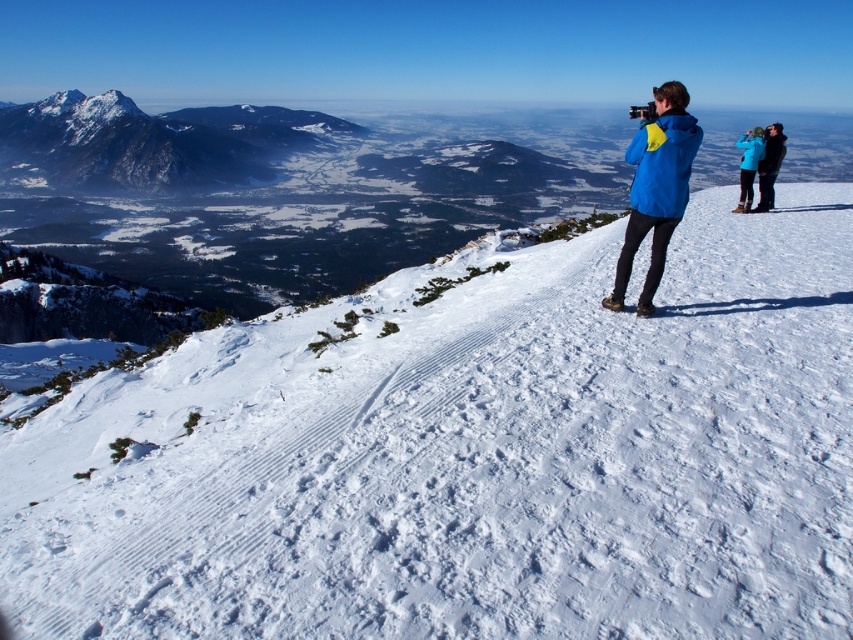
Can you confirm if blue/yellow jacket at upper right is positioned to the right of blue fleece jacket at upper right?

No, blue/yellow jacket at upper right is not to the right of blue fleece jacket at upper right.

Can you confirm if blue/yellow jacket at upper right is shorter than blue fleece jacket at upper right?

Yes, blue/yellow jacket at upper right is shorter than blue fleece jacket at upper right.

Is point (695, 147) positioned behind point (741, 157)?

No.

The image size is (853, 640). I want to click on blue/yellow jacket at upper right, so click(x=656, y=188).

Does white snow at upper center lie behind snowy granite mountain at upper left?

No, it is in front of snowy granite mountain at upper left.

Does white snow at upper center have a lesser height compared to snowy granite mountain at upper left?

Indeed, white snow at upper center has a lesser height compared to snowy granite mountain at upper left.

The height and width of the screenshot is (640, 853). What do you see at coordinates (473, 458) in the screenshot?
I see `white snow at upper center` at bounding box center [473, 458].

This screenshot has height=640, width=853. I want to click on white snow at upper center, so click(473, 458).

Is white snow at upper center above blue fleece jacket at upper right?

No.

Who is taller, white snow at upper center or blue fleece jacket at upper right?

blue fleece jacket at upper right

Does point (682, 410) come farther from viewer compared to point (747, 209)?

No, (682, 410) is closer to viewer.

What are the coordinates of `white snow at upper center` in the screenshot? It's located at (473, 458).